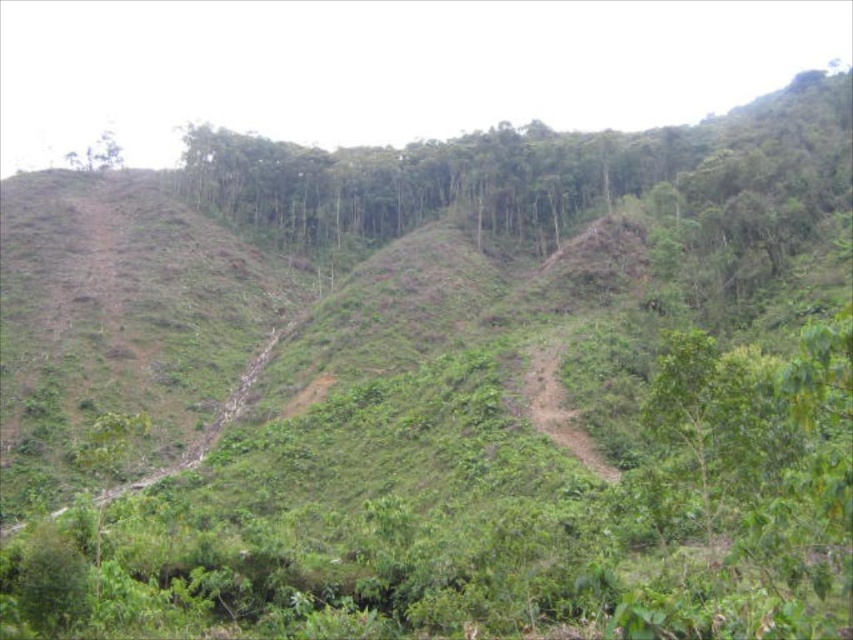
You are a hiker trying to reach the green leafy tree at upper left from the brown dirt track at center. Based on the scene description, which direction should you head to move towards the tree?

The brown dirt track at center is in front of green leafy tree at upper left, so you should head towards the upper left direction to reach the tree.